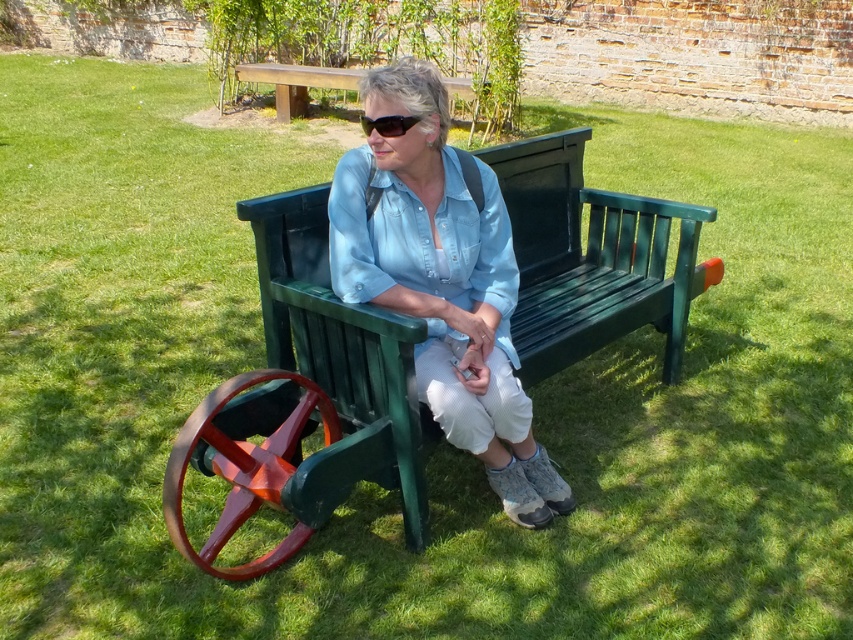
Question: Which is farther from the matte green bench at center?

Choices:
 (A) green painted wood park bench at center
 (B) black plastic sunglasses at center

Answer: (B)

Question: Does green painted wood park bench at center have a larger size compared to matte green bench at center?

Choices:
 (A) no
 (B) yes

Answer: (B)

Question: Does matte green bench at center come behind black plastic sunglasses at center?

Choices:
 (A) no
 (B) yes

Answer: (A)

Question: Considering the real-world distances, which object is farthest from the black plastic sunglasses at center?

Choices:
 (A) matte green bench at center
 (B) green painted wood park bench at center

Answer: (B)

Question: Which object appears closest to the camera in this image?

Choices:
 (A) black plastic sunglasses at center
 (B) matte green bench at center
 (C) green painted wood park bench at center

Answer: (B)

Question: Is green painted wood park bench at center to the right of matte green bench at center from the viewer's perspective?

Choices:
 (A) yes
 (B) no

Answer: (A)